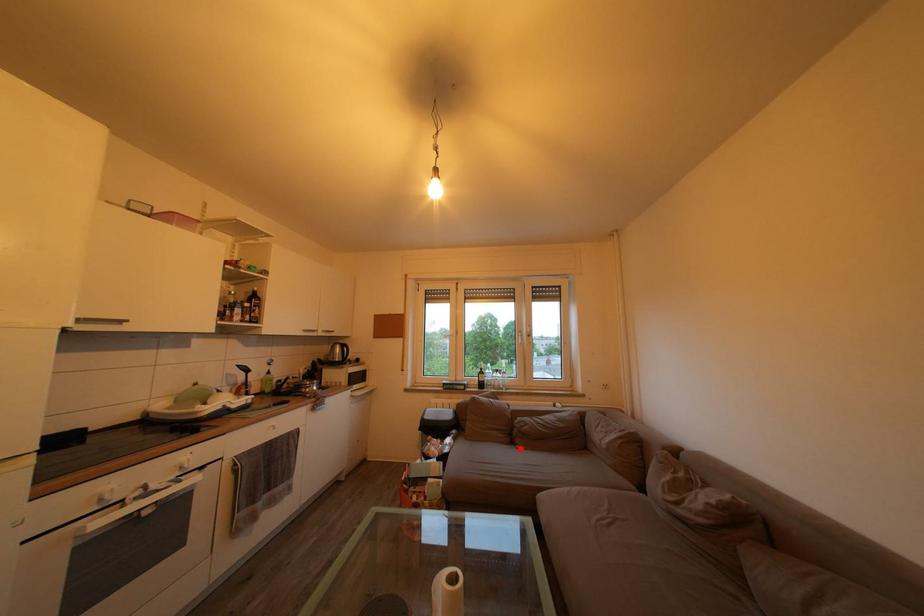
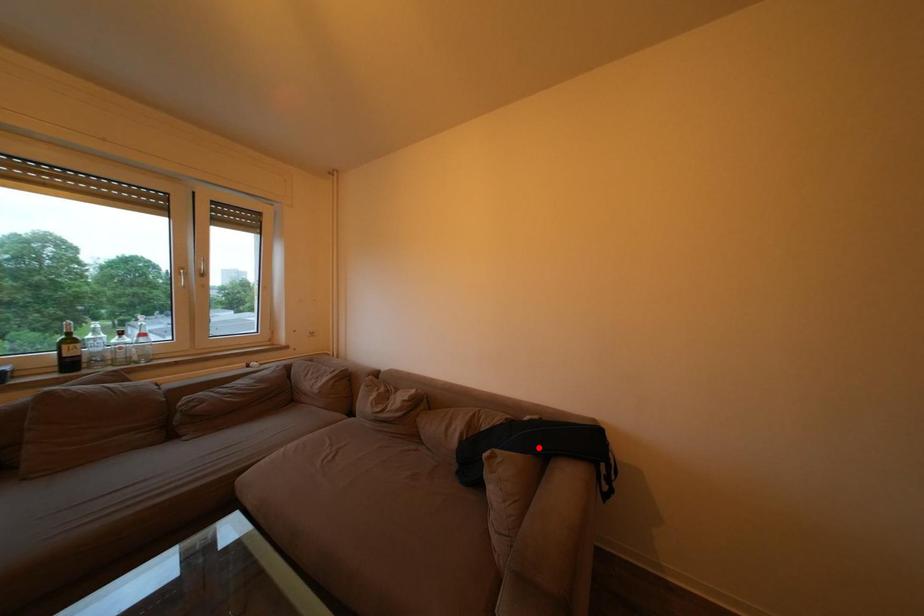
I am providing you with two images of the same scene from different viewpoints. A red point is marked on the first image and another point is marked on the second image. Does the point marked in image1 correspond to the same location as the one in image2?

No